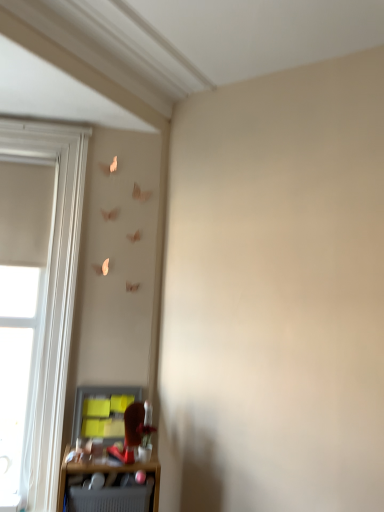
Question: Is white wood window at left positioned with its back to matte gray shelf at lower left?

Choices:
 (A) yes
 (B) no

Answer: (B)

Question: Is white wood window at left far from matte gray shelf at lower left?

Choices:
 (A) yes
 (B) no

Answer: (B)

Question: Is white wood window at left closer to camera compared to matte gray shelf at lower left?

Choices:
 (A) yes
 (B) no

Answer: (B)

Question: Is matte gray shelf at lower left a part of white wood window at left?

Choices:
 (A) no
 (B) yes

Answer: (A)

Question: Does white wood window at left turn towards matte gray shelf at lower left?

Choices:
 (A) no
 (B) yes

Answer: (A)

Question: Considering the relative sizes of white wood window at left and matte gray shelf at lower left in the image provided, is white wood window at left taller than matte gray shelf at lower left?

Choices:
 (A) no
 (B) yes

Answer: (B)

Question: Does white wood window at left have a lesser height compared to matte gray cabinet at lower left?

Choices:
 (A) yes
 (B) no

Answer: (B)

Question: Is matte gray cabinet at lower left at the back of white wood window at left?

Choices:
 (A) no
 (B) yes

Answer: (A)

Question: From the image's perspective, would you say white wood window at left is shown under matte gray cabinet at lower left?

Choices:
 (A) no
 (B) yes

Answer: (A)

Question: Can you confirm if white wood window at left is bigger than matte gray cabinet at lower left?

Choices:
 (A) no
 (B) yes

Answer: (B)

Question: Is white wood window at left not inside matte gray cabinet at lower left?

Choices:
 (A) yes
 (B) no

Answer: (A)

Question: Is white wood window at left oriented towards matte gray cabinet at lower left?

Choices:
 (A) no
 (B) yes

Answer: (A)

Question: Is matte gray shelf at lower left facing towards matte gray cabinet at lower left?

Choices:
 (A) yes
 (B) no

Answer: (B)